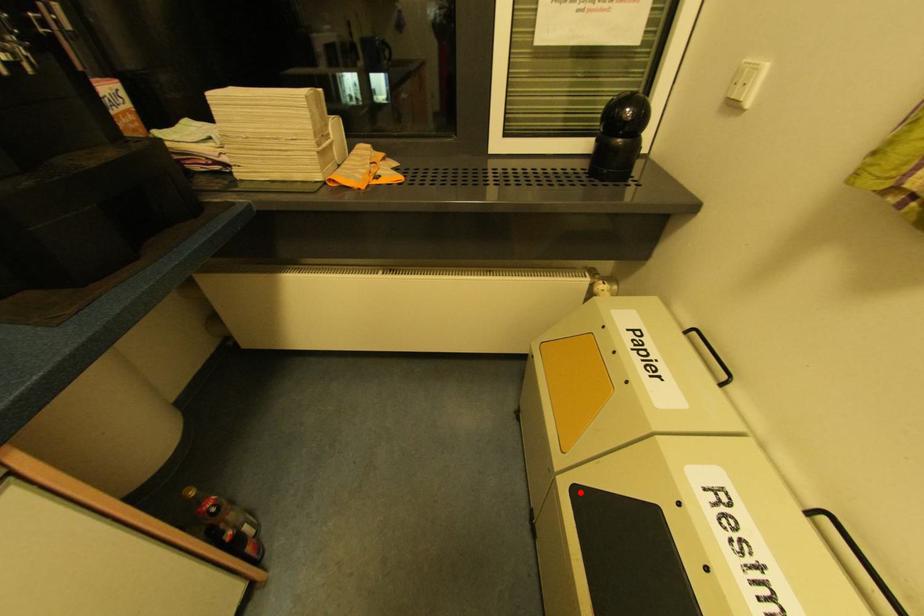
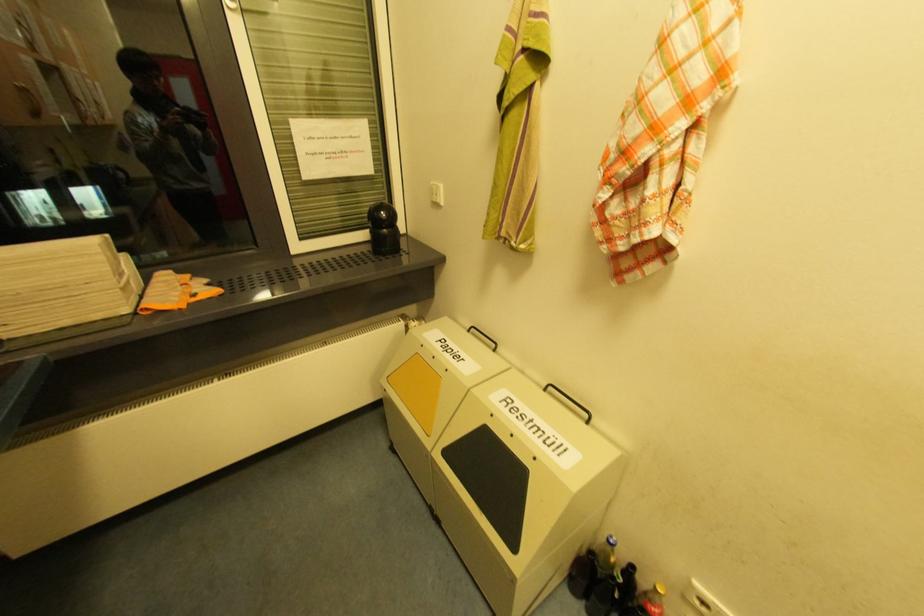
Question: I am providing you with two images of the same scene from different viewpoints. Image1 has a red point marked. In image2, the corresponding 3D location appears at what relative position? Reply with the corresponding letter.

Choices:
 (A) Closer
 (B) Farther

Answer: (B)